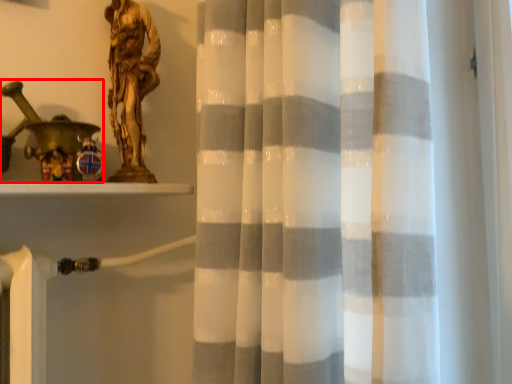
Question: From the image's perspective, considering the relative positions of toy (annotated by the red box) and sculpture in the image provided, where is toy (annotated by the red box) located with respect to the staircase?

Choices:
 (A) above
 (B) below

Answer: (B)